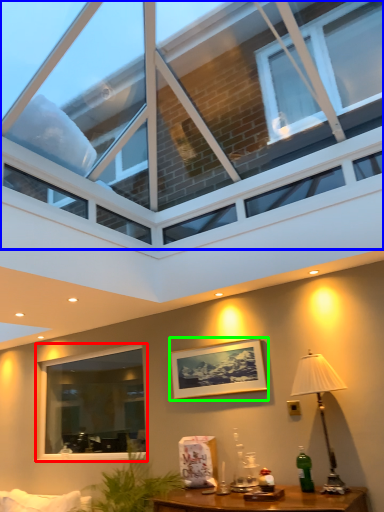
Question: Which is nearer to the window (highlighted by a red box)? window (highlighted by a blue box) or picture frame (highlighted by a green box).

Choices:
 (A) window
 (B) picture frame

Answer: (B)